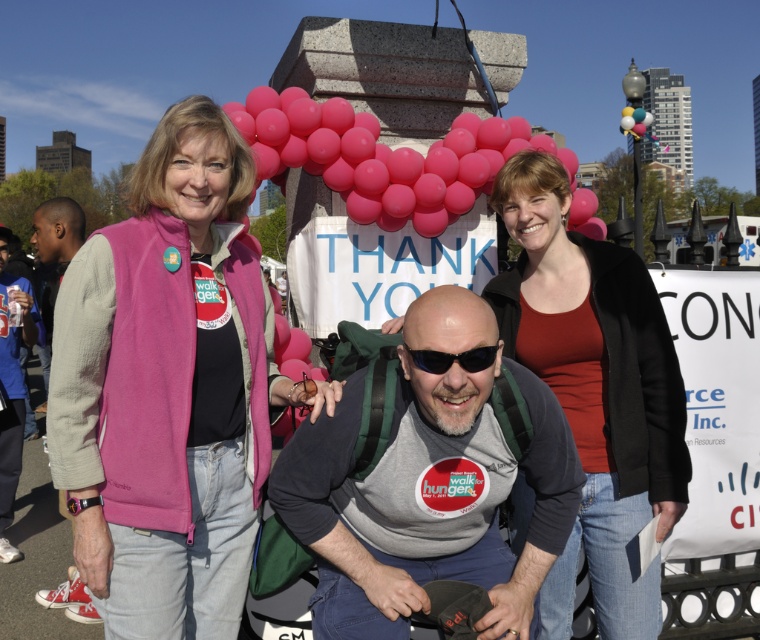
Question: Is pink rubber balloons at upper center wider than black plastic sunglasses at center?

Choices:
 (A) yes
 (B) no

Answer: (A)

Question: Is pink rubber balloons at upper center further to camera compared to red canvas sneakers at lower left?

Choices:
 (A) yes
 (B) no

Answer: (B)

Question: Where is matte black jacket at center located in relation to red canvas sneakers at lower left in the image?

Choices:
 (A) left
 (B) right

Answer: (B)

Question: Which of these objects is positioned closest to the pink rubber balloons at upper center?

Choices:
 (A) pink fleece vest at left
 (B) matte black jacket at center

Answer: (A)

Question: Which point is closer to the camera taking this photo?

Choices:
 (A) (138, 173)
 (B) (445, 364)
 (C) (325, 513)
 (D) (312, 157)

Answer: (B)

Question: Which object is the farthest from the pink rubber balloons at upper center?

Choices:
 (A) pink fleece vest at left
 (B) black plastic sunglasses at center
 (C) matte black jacket at center
 (D) gray fabric shirt at center

Answer: (B)